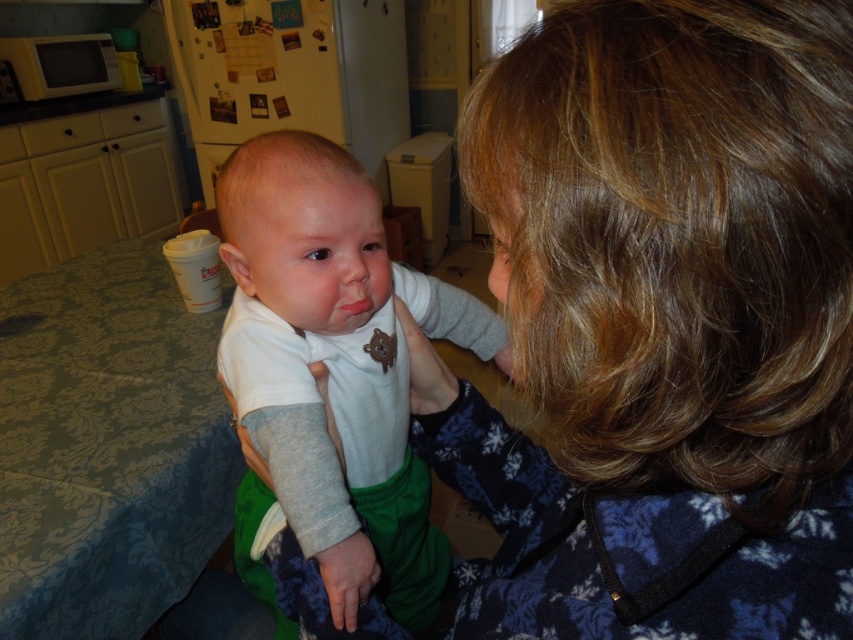
Which is in front, point (573, 323) or point (387, 396)?

Point (573, 323) is in front.

Does blue fleece jacket at upper right have a lesser height compared to white soft fabric baby at center?

Indeed, blue fleece jacket at upper right has a lesser height compared to white soft fabric baby at center.

Describe the element at coordinates (660, 323) in the screenshot. I see `blue fleece jacket at upper right` at that location.

At what (x,y) coordinates should I click in order to perform the action: click on blue fleece jacket at upper right. Please return your answer as a coordinate pair (x, y). Looking at the image, I should click on (660, 323).